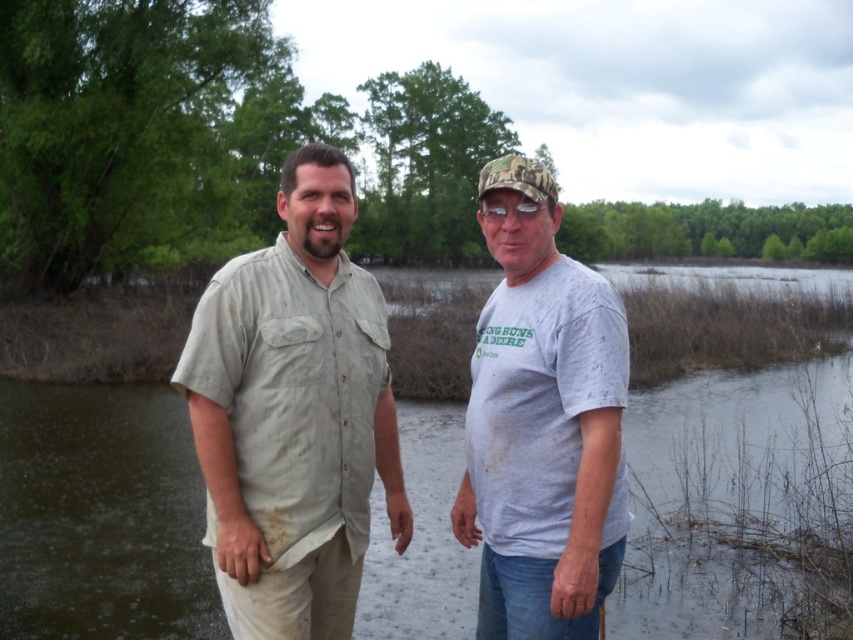
You are a photographer trying to capture a closeup of the light beige cotton shirt at center. The camera you are using has a focal length of 50mm. If you want to focus on the light beige cotton shirt at center, which is at point [294,413], where should you aim the camera?

The light beige cotton shirt at center is located at point [294,413], so you should aim the camera at point [294,413] to focus on it.